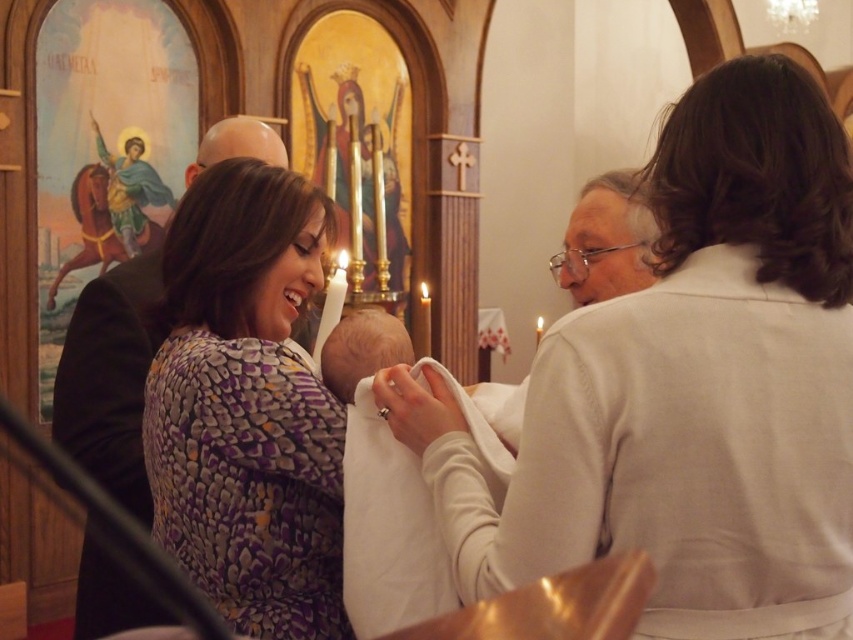
How much distance is there between white matte shirt at upper right and dark brown leather jacket at left?

They are 5.34 meters apart.

Based on the photo, can you confirm if white matte shirt at upper right is thinner than dark brown leather jacket at left?

Incorrect, white matte shirt at upper right's width is not less than dark brown leather jacket at left's.

Who is more distant from viewer, (480, 529) or (128, 365)?

The point (128, 365) is behind.

Where is `white matte shirt at upper right`? white matte shirt at upper right is located at coordinates (689, 388).

Between purple printed dress at center and dark brown leather jacket at left, which one appears on the left side from the viewer's perspective?

From the viewer's perspective, dark brown leather jacket at left appears more on the left side.

Is purple printed dress at center shorter than dark brown leather jacket at left?

No, purple printed dress at center is not shorter than dark brown leather jacket at left.

The image size is (853, 640). What do you see at coordinates (247, 406) in the screenshot?
I see `purple printed dress at center` at bounding box center [247, 406].

You are a GUI agent. You are given a task and a screenshot of the screen. Output one action in this format:
    pyautogui.click(x=<x>, y=<y>)
    Task: Click on the purple printed dress at center
    
    Given the screenshot: What is the action you would take?
    pyautogui.click(x=247, y=406)

Measure the distance between white matte shirt at upper right and purple printed dress at center.

white matte shirt at upper right is 2.19 meters from purple printed dress at center.

Who is higher up, white matte shirt at upper right or purple printed dress at center?

white matte shirt at upper right

Is point (711, 96) less distant than point (263, 524)?

Yes, it is in front of point (263, 524).

The height and width of the screenshot is (640, 853). I want to click on white matte shirt at upper right, so click(x=689, y=388).